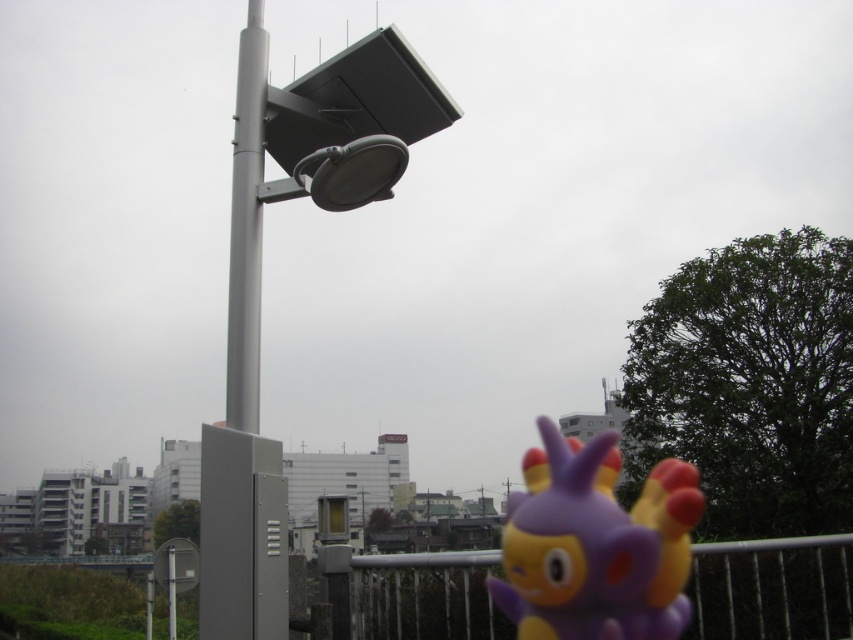
You are a maintenance worker who needs to replace a light bulb on the gray metallic pole at center. The white metal fence at lower center is in the way. Can you reach the pole without climbing over the fence?

The white metal fence at lower center is shorter than the gray metallic pole at center, so you can likely reach the pole without climbing over the fence since the fence is not tall enough to obstruct your access.

You are a maintenance worker needing to reach the satin silver pole at upper center for inspection. Your ladder can extend up to 3 meters. Can you safely reach the pole with your ladder?

The satin silver pole at upper center is 2.86 meters away from the camera, so yes, the ladder can extend up to 3 meters, which is sufficient to reach the pole safely.

You are a delivery drone that needs to navigate between the satin silver pole at upper center and the white metal fence at lower center. Which object is located to the left of the other?

The satin silver pole at upper center is positioned on the left side of the white metal fence at lower center.